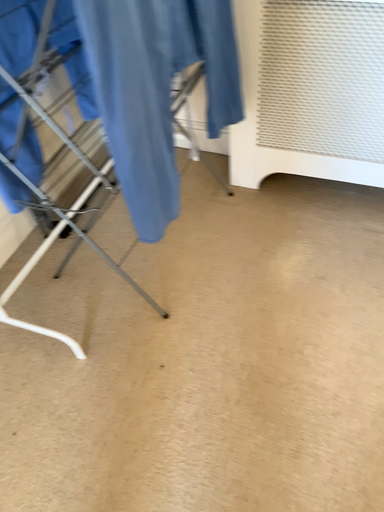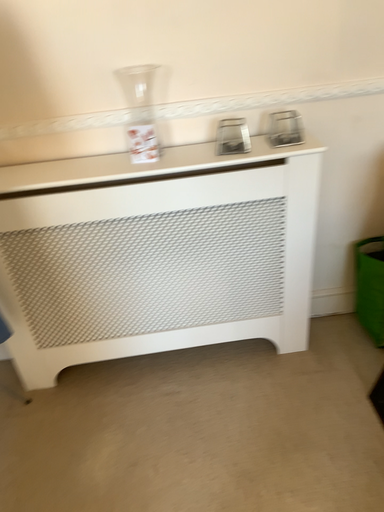
Question: How did the camera likely rotate when shooting the video?

Choices:
 (A) rotated left
 (B) rotated right

Answer: (B)